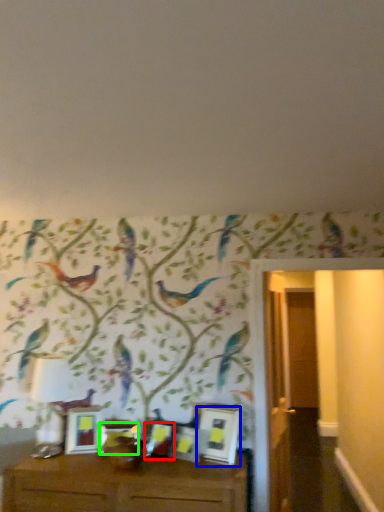
Question: Which object is the farthest from picture frame (highlighted by a red box)? Choose among these: picture frame (highlighted by a blue box) or picture frame (highlighted by a green box).

Choices:
 (A) picture frame
 (B) picture frame

Answer: (A)